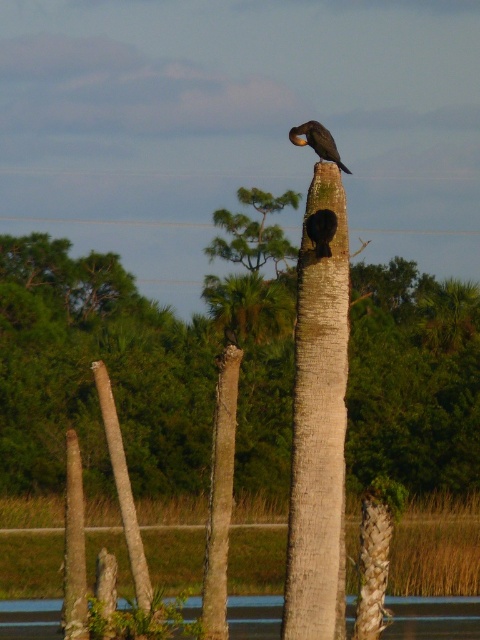
Question: Among these objects, which one is nearest to the camera?

Choices:
 (A) smooth brown tree trunk at center
 (B) brown rough tree trunk at center
 (C) green leafy tree at center
 (D) transparent glass water at center

Answer: (A)

Question: Can you confirm if transparent glass water at center is wider than black matte bird at center?

Choices:
 (A) no
 (B) yes

Answer: (B)

Question: Which of these objects is positioned closest to the smooth brown tree trunk at center?

Choices:
 (A) transparent glass water at center
 (B) brown rough tree trunk at center
 (C) black matte bird at center

Answer: (A)

Question: Is smooth brown tree trunk at center thinner than black matte bird at center?

Choices:
 (A) no
 (B) yes

Answer: (A)

Question: Can you confirm if brown rough tree trunk at center is positioned above shiny black bird at center?

Choices:
 (A) no
 (B) yes

Answer: (A)

Question: Which of the following is the closest to the observer?

Choices:
 (A) (232, 419)
 (B) (328, 214)
 (C) (309, 124)
 (D) (288, 204)

Answer: (B)